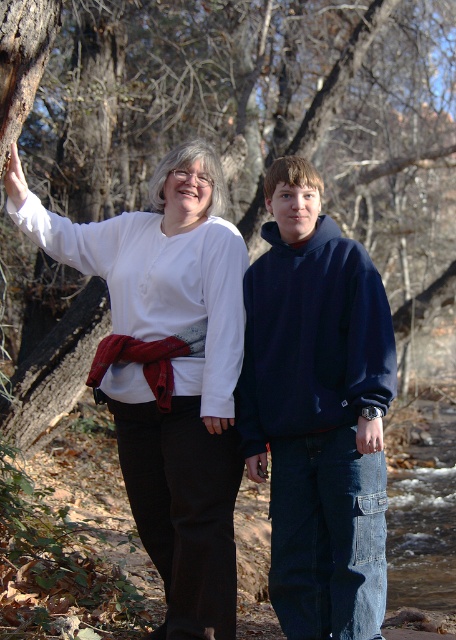
You are a photographer taking a picture of the two people in the scene. You want to focus on the person closer to the camera. Which point should you focus on, point (186, 60) or point (377, 384)?

Point (186, 60) is further to the camera than point (377, 384). Therefore, you should focus on point (186, 60) to capture the person closer to the camera.

You are trying to take a photo of the navy blue hoodie at center but the smooth bark tree trunk at left is blocking your view. Can you move to the right side to get a clear shot?

The smooth bark tree trunk at left is positioned over the navy blue hoodie at center, so moving to the right side may allow you to see around the tree trunk and capture the navy blue hoodie at center without obstruction.